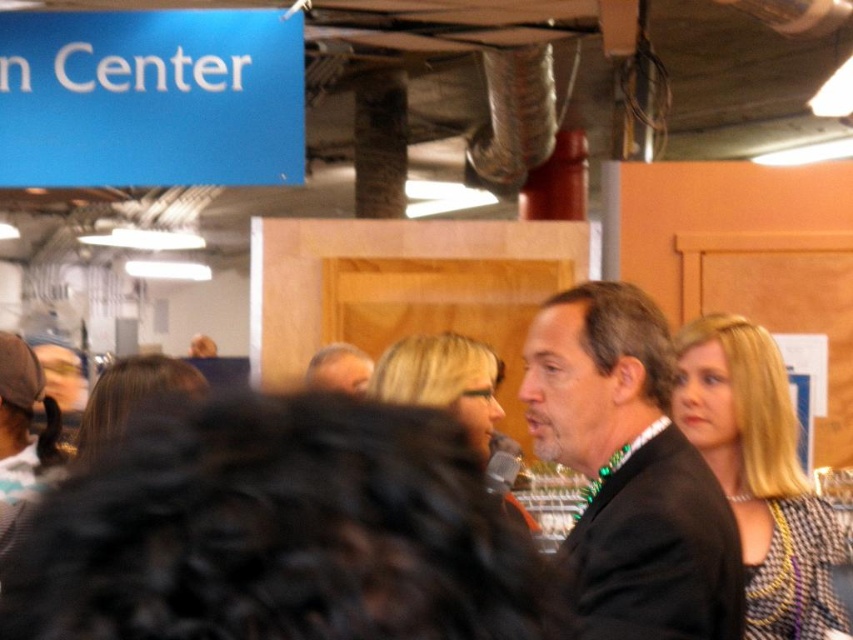
Question: Does black suit at center appear on the left side of wooden bulletin board at right?

Choices:
 (A) no
 (B) yes

Answer: (B)

Question: Based on their relative distances, which object is farther from the light brown hair at center?

Choices:
 (A) wooden bulletin board at right
 (B) black suit at center

Answer: (B)

Question: Based on their relative distances, which object is nearer to the black suit at center?

Choices:
 (A) wooden bulletin board at right
 (B) light brown hair at center

Answer: (B)

Question: Among these points, which one is farthest from the camera?

Choices:
 (A) click(827, 241)
 (B) click(601, 330)

Answer: (A)

Question: Can you confirm if black suit at center is positioned above light brown hair at center?

Choices:
 (A) no
 (B) yes

Answer: (A)

Question: Does wooden bulletin board at right lie behind light brown hair at center?

Choices:
 (A) no
 (B) yes

Answer: (A)